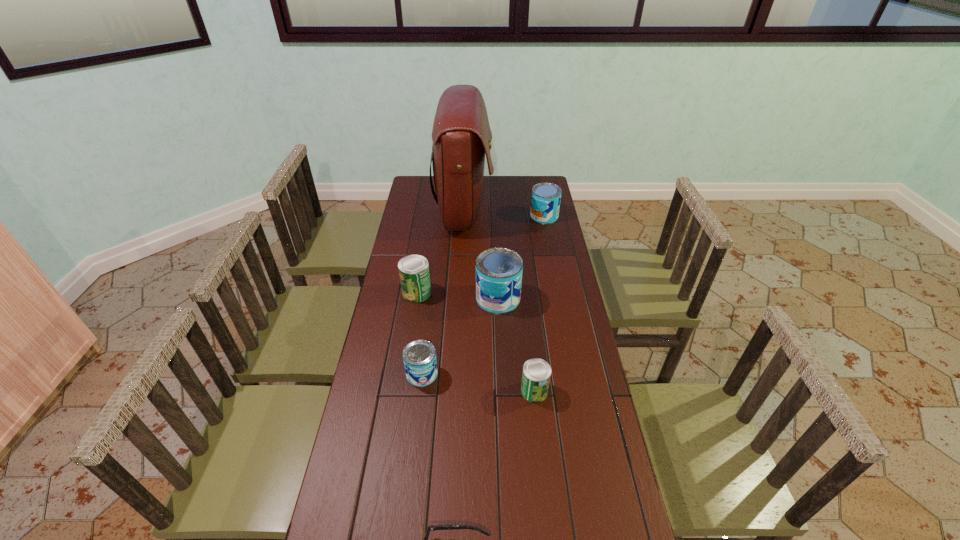
At what (x,y) coordinates should I click in order to perform the action: click on object that is at the far left corner. Please return your answer as a coordinate pair (x, y). The image size is (960, 540). Looking at the image, I should click on (461, 134).

The image size is (960, 540). In the image, there is a desktop. Identify the location of free space at the left edge. (399, 252).

The height and width of the screenshot is (540, 960). In the image, there is a desktop. Identify the location of free region at the right edge. (551, 320).

Locate an element on the screen. The height and width of the screenshot is (540, 960). vacant space at the far left corner of the desktop is located at coordinates (423, 188).

Locate an element on the screen. vacant area at the far right corner is located at coordinates (520, 177).

Locate an element on the screen. unoccupied area between the left green can and the smaller green can is located at coordinates (475, 341).

The width and height of the screenshot is (960, 540). What are the coordinates of `free space between the second smallest blue can and the second blue can from left to right` in the screenshot? It's located at (521, 257).

You are a GUI agent. You are given a task and a screenshot of the screen. Output one action in this format:
    pyautogui.click(x=<x>, y=<y>)
    Task: Click on the free space between the nearer green can and the second nearest blue can
    
    Given the screenshot: What is the action you would take?
    pyautogui.click(x=516, y=345)

I want to click on free space between the nearest blue can and the second blue can from right to left, so click(x=460, y=336).

This screenshot has width=960, height=540. I want to click on vacant space that is in between the rightmost object and the smaller green can, so click(540, 303).